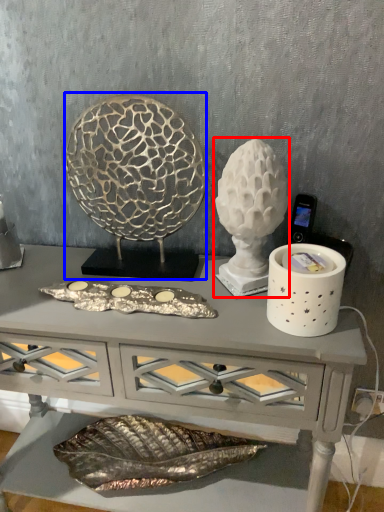
Question: Which object is closer to the camera taking this photo, sculpture (highlighted by a red box) or sculpture (highlighted by a blue box)?

Choices:
 (A) sculpture
 (B) sculpture

Answer: (A)